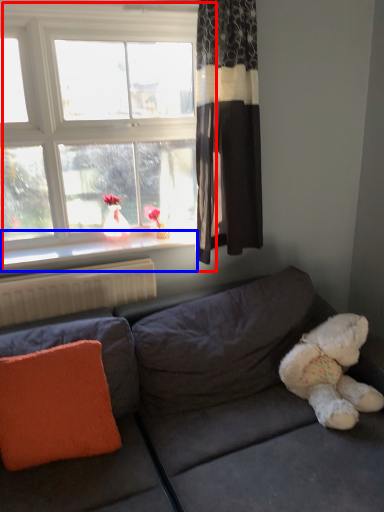
Question: Which of the following is the closest to the observer, window (highlighted by a red box) or window sill (highlighted by a blue box)?

Choices:
 (A) window
 (B) window sill

Answer: (A)